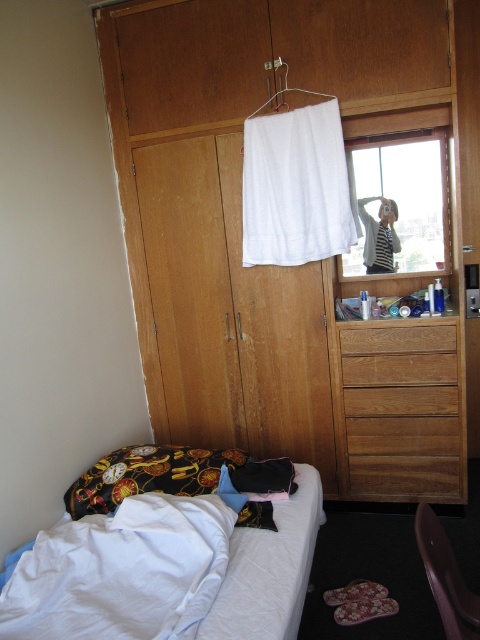
You are organizing items in the bedroom and need to place a tall plant that requires sunlight. You have a brown wooden drawer at right and a transparent glass window at upper center. Which object should you place the plant near to ensure it gets enough light?

The transparent glass window at upper center allows sunlight to enter, so placing the plant near the transparent glass window at upper center would ensure it gets enough light.

You are trying to decide whether to place a narrow bookshelf between the wooden chair at lower right and the wooden drawer at center. Based on their widths, can the bookshelf fit between them?

The wooden chair at lower right is thinner than the wooden drawer at center, so the space between them may be sufficient for a narrow bookshelf. However, the exact fit depends on the bookshelf dimensions and the distance between the two objects.